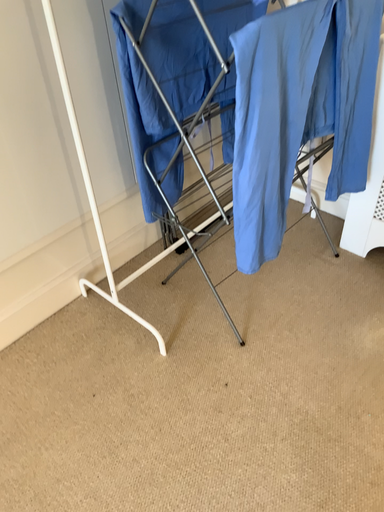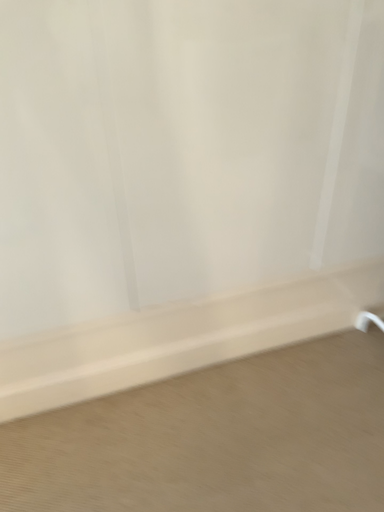
Question: How did the camera likely rotate when shooting the video?

Choices:
 (A) rotated right
 (B) rotated left

Answer: (B)